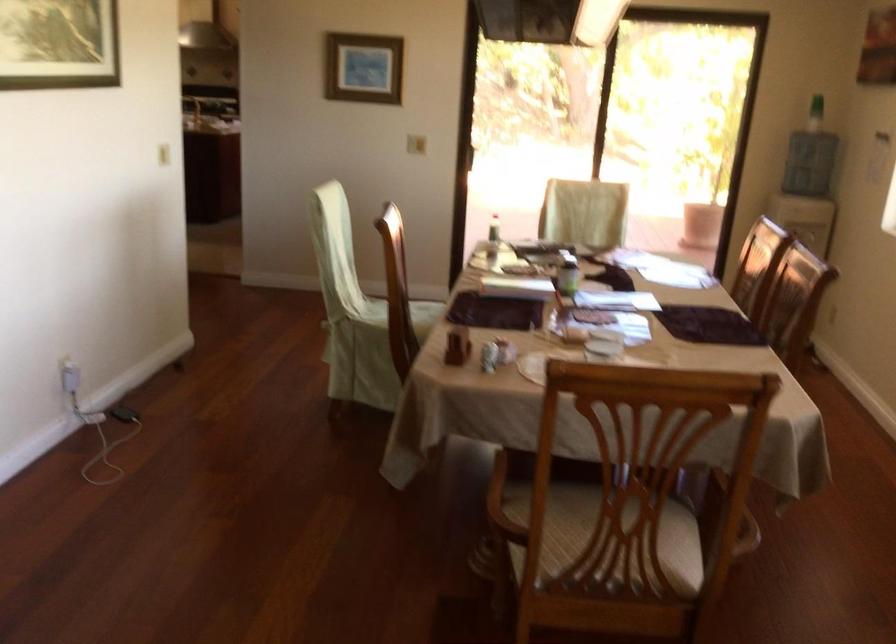
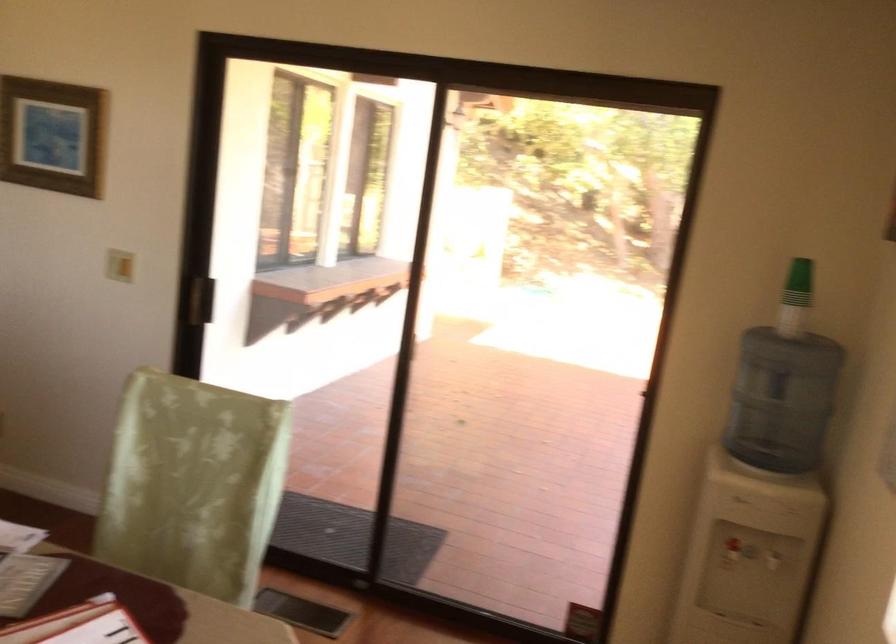
Consider the image. What movement of the cameraman would produce the second image?

The cameraman moved toward right, forward.